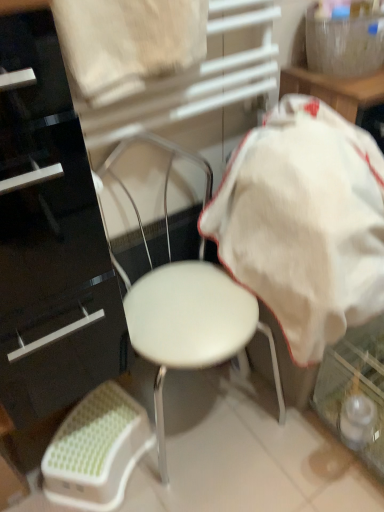
Question: Looking at the image, does white cotton blanket at center seem bigger or smaller compared to glossy black dresser at left?

Choices:
 (A) small
 (B) big

Answer: (A)

Question: From the image's perspective, is white cotton blanket at center above or below glossy black dresser at left?

Choices:
 (A) above
 (B) below

Answer: (A)

Question: Which object is the farthest from the white cotton blanket at center?

Choices:
 (A) white fabric at upper center
 (B) glossy black dresser at left
 (C) white matte chair at center
 (D) white plastic bar stool at lower left

Answer: (D)

Question: Considering the real-world distances, which object is farthest from the white plastic bar stool at lower left?

Choices:
 (A) glossy black dresser at left
 (B) white fabric at upper center
 (C) white matte chair at center
 (D) white cotton blanket at center

Answer: (B)